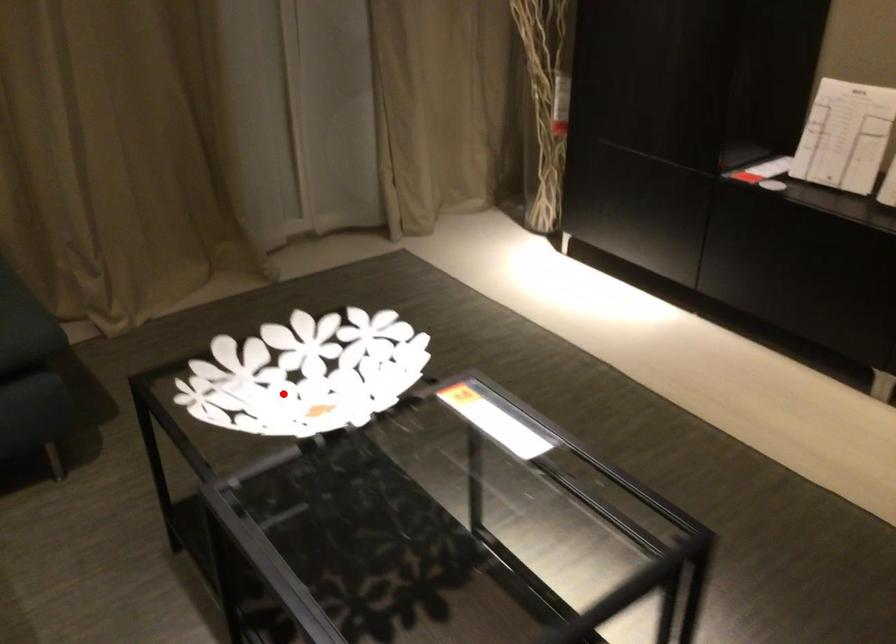
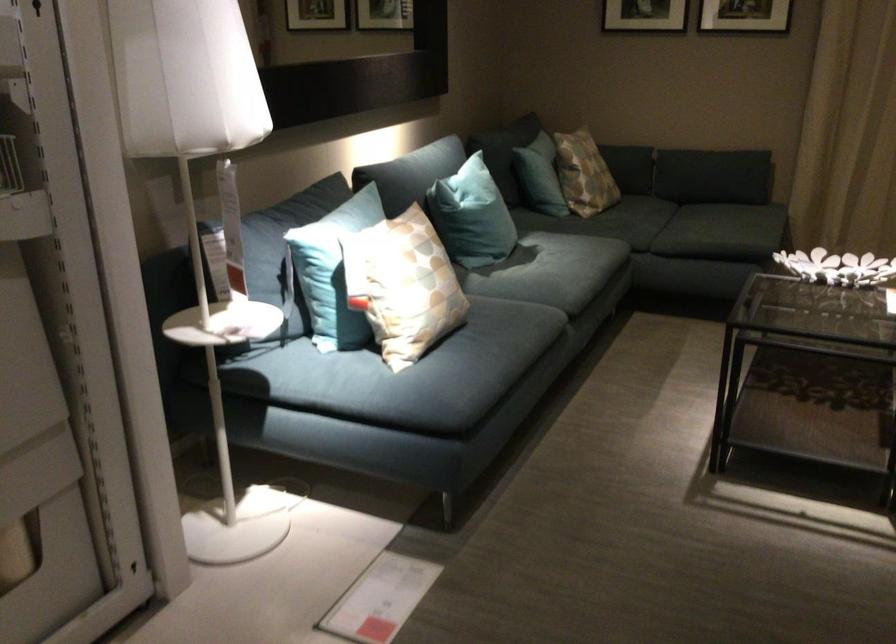
Question: I am providing you with two images of the same scene from different viewpoints. Given a red point in image1, look at the same physical point in image2. Is it:

Choices:
 (A) Closer to the viewpoint
 (B) Farther from the viewpoint

Answer: (B)